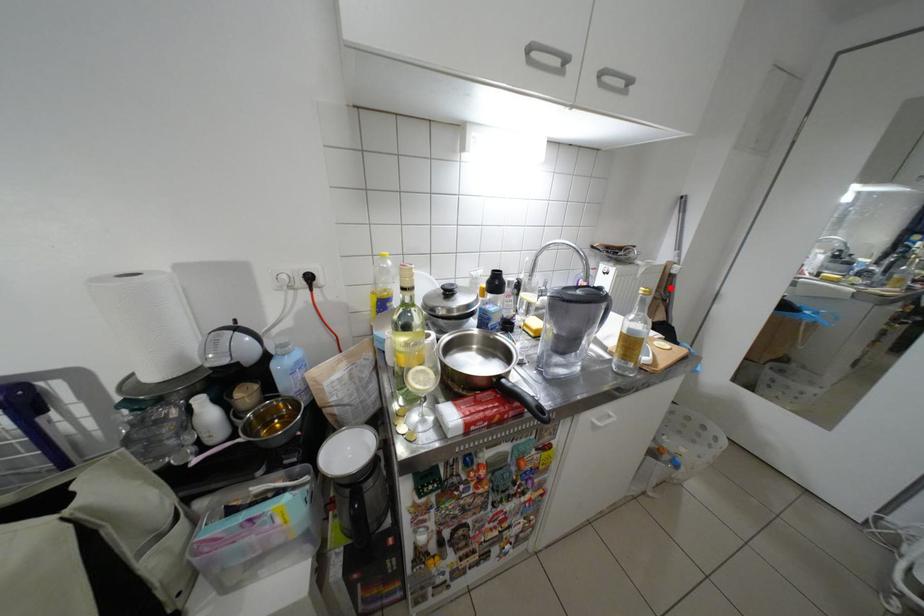
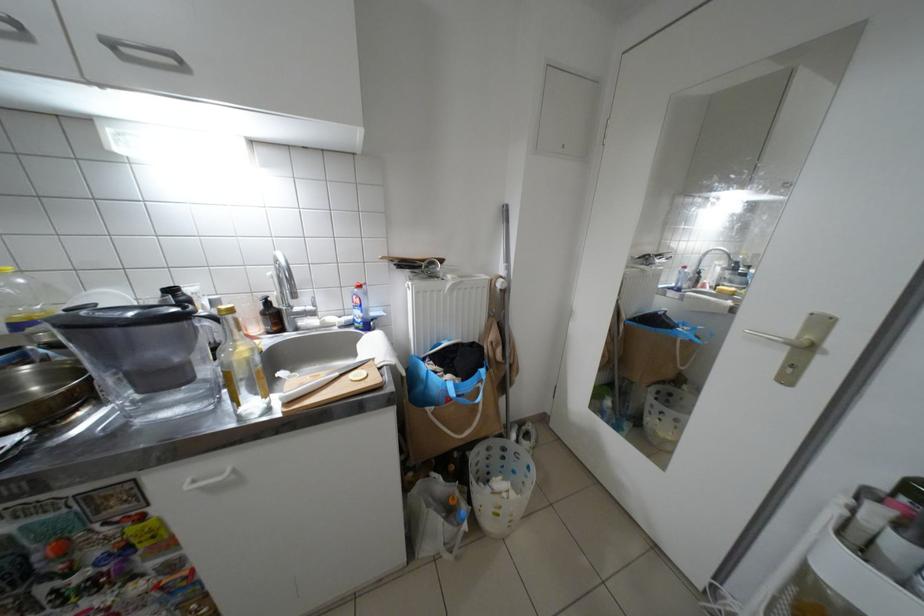
Find the pixel in the second image that matches the highlighted location in the first image.

(502, 304)